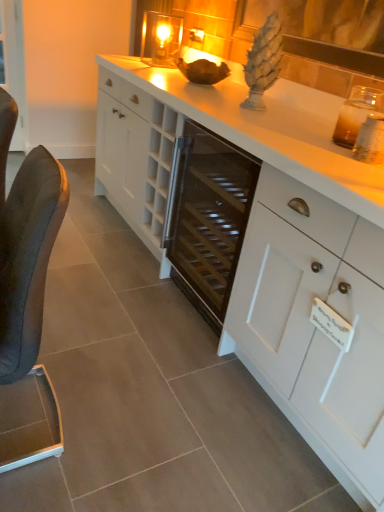
Question: Is black leather chair at left aimed at white matte cabinet at center?

Choices:
 (A) yes
 (B) no

Answer: (B)

Question: Is black leather chair at left far away from white matte cabinet at center?

Choices:
 (A) no
 (B) yes

Answer: (A)

Question: From a real-world perspective, is black leather chair at left on white matte cabinet at center?

Choices:
 (A) yes
 (B) no

Answer: (B)

Question: Does black leather chair at left come behind white matte cabinet at center?

Choices:
 (A) yes
 (B) no

Answer: (A)

Question: Is black leather chair at left positioned with its back to white matte cabinet at center?

Choices:
 (A) yes
 (B) no

Answer: (A)

Question: Is black leather chair at left thinner than white matte cabinet at center?

Choices:
 (A) yes
 (B) no

Answer: (A)

Question: From a real-world perspective, is clear glass candle at upper center physically above white matte cabinet at center?

Choices:
 (A) no
 (B) yes

Answer: (B)

Question: Are clear glass candle at upper center and white matte cabinet at center beside each other?

Choices:
 (A) yes
 (B) no

Answer: (B)

Question: Considering the relative sizes of clear glass candle at upper center and white matte cabinet at center in the image provided, is clear glass candle at upper center thinner than white matte cabinet at center?

Choices:
 (A) yes
 (B) no

Answer: (A)

Question: From the image's perspective, is clear glass candle at upper center on top of white matte cabinet at center?

Choices:
 (A) no
 (B) yes

Answer: (B)

Question: Can you confirm if clear glass candle at upper center is smaller than white matte cabinet at center?

Choices:
 (A) yes
 (B) no

Answer: (A)

Question: Is clear glass candle at upper center bigger than white matte cabinet at center?

Choices:
 (A) no
 (B) yes

Answer: (A)

Question: Is transparent glass door at left directly adjacent to white glossy countertop at center?

Choices:
 (A) no
 (B) yes

Answer: (A)